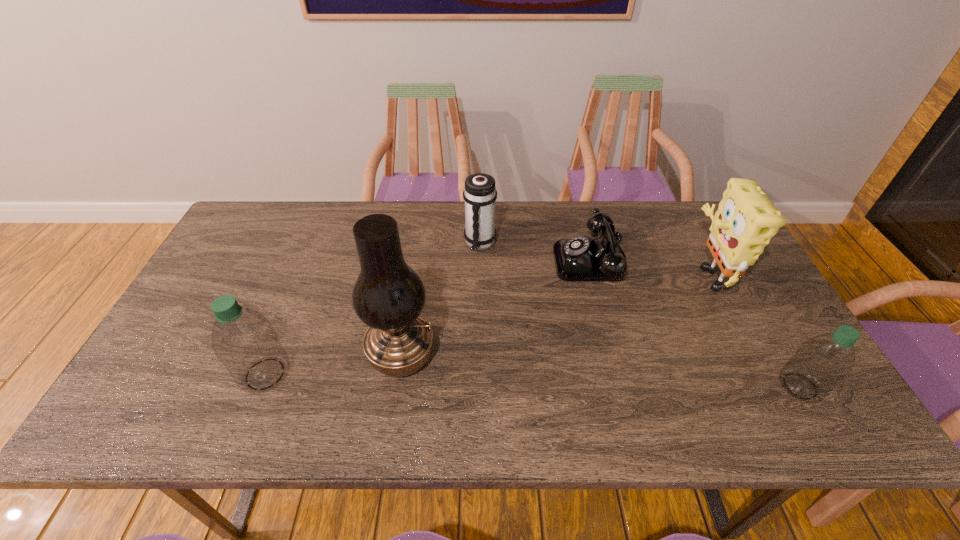
I want to click on vacant spot for a new water_bottle to ensure equal spacing, so click(530, 380).